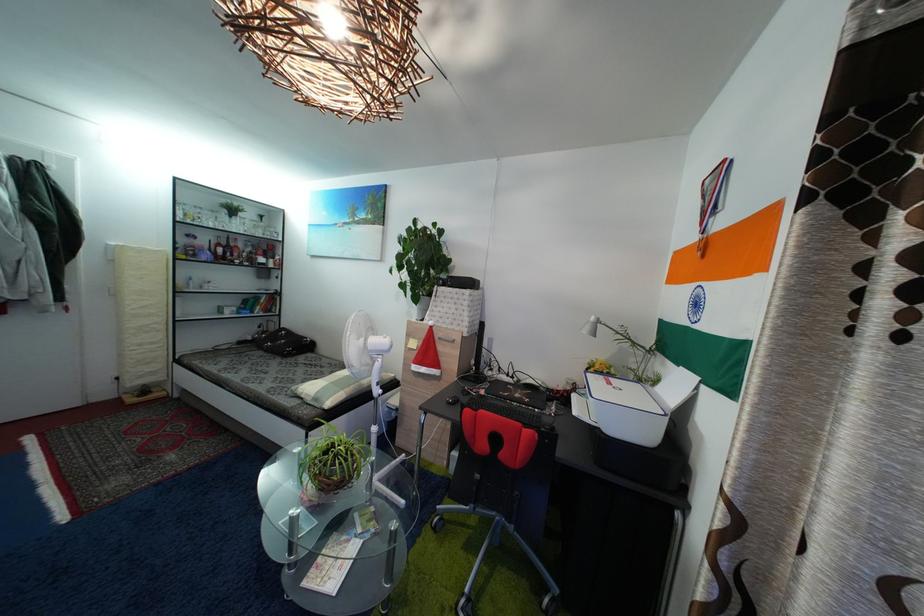
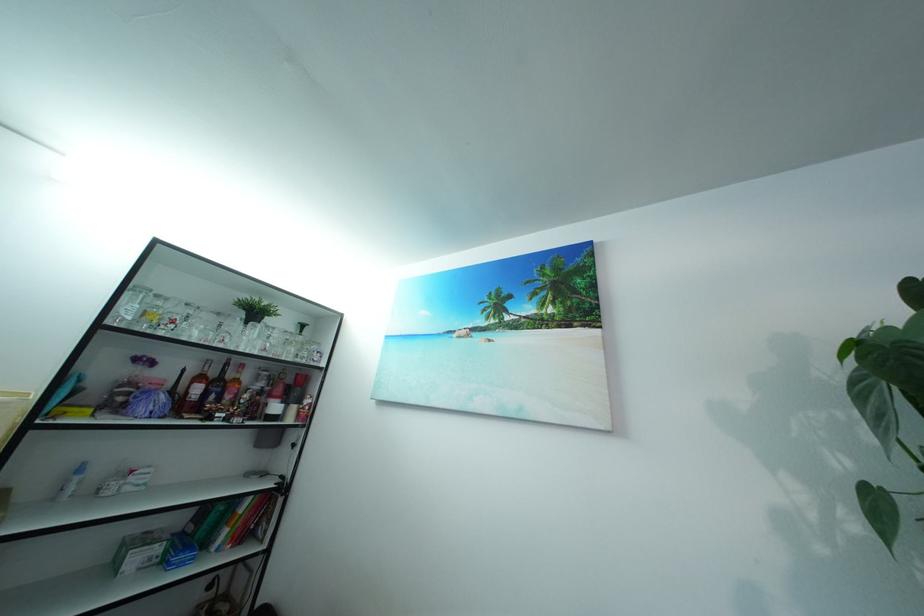
Find the pixel in the second image that matches the point at 245,233 in the first image.

(257, 347)